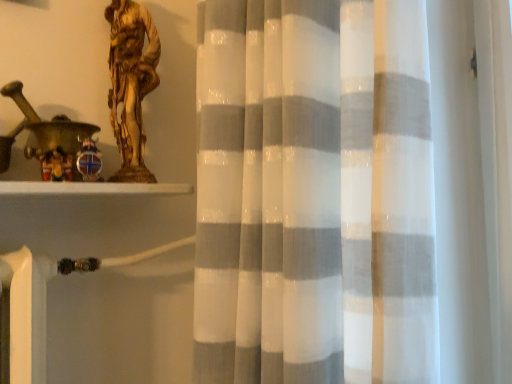
Question: Is wooden figurine at left taller or shorter than gold metallic statue at upper left?

Choices:
 (A) tall
 (B) short

Answer: (B)

Question: Is wooden figurine at left wider or thinner than gold metallic statue at upper left?

Choices:
 (A) wide
 (B) thin

Answer: (A)

Question: Relative to gold metallic statue at upper left, is wooden figurine at left in front or behind?

Choices:
 (A) front
 (B) behind

Answer: (A)

Question: Visually, is gold metallic statue at upper left positioned to the left or to the right of wooden figurine at left?

Choices:
 (A) left
 (B) right

Answer: (B)

Question: From the image's perspective, is gold metallic statue at upper left located above or below wooden figurine at left?

Choices:
 (A) above
 (B) below

Answer: (A)

Question: Is gold metallic statue at upper left wider or thinner than wooden figurine at left?

Choices:
 (A) wide
 (B) thin

Answer: (B)

Question: Is gold metallic statue at upper left in front of or behind wooden figurine at left in the image?

Choices:
 (A) front
 (B) behind

Answer: (B)